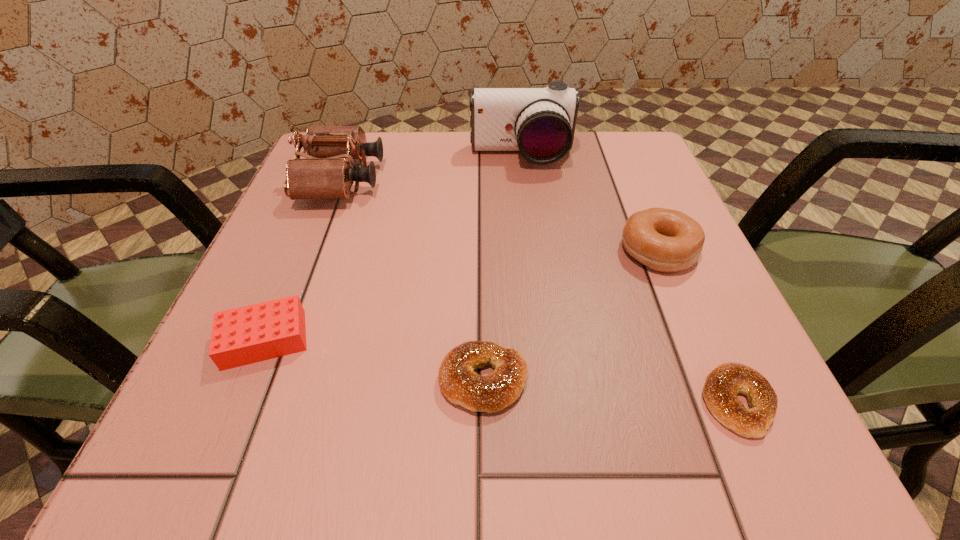
In the image, there is a desktop. Where is `vacant space at the far edge`? vacant space at the far edge is located at coordinates (468, 167).

Image resolution: width=960 pixels, height=540 pixels. I want to click on vacant position at the near edge of the desktop, so click(394, 429).

This screenshot has height=540, width=960. In the image, there is a desktop. Find the location of `vacant space at the left edge`. vacant space at the left edge is located at coordinates (316, 211).

In the image, there is a desktop. Identify the location of vacant space at the right edge. (600, 194).

Find the location of a particular element. This screenshot has width=960, height=540. free space at the far right corner of the desktop is located at coordinates (597, 161).

You are a GUI agent. You are given a task and a screenshot of the screen. Output one action in this format:
    pyautogui.click(x=<x>, y=<y>)
    Task: Click on the blank area at the near right corner
    
    Given the screenshot: What is the action you would take?
    pyautogui.click(x=708, y=441)

Image resolution: width=960 pixels, height=540 pixels. What are the coordinates of `unoccupied area between the third tallest object and the Lego` in the screenshot? It's located at (462, 295).

At what (x,y) coordinates should I click in order to perform the action: click on empty space between the third shortest object and the fourth nearest object. Please return your answer as a coordinate pair (x, y). This screenshot has width=960, height=540. Looking at the image, I should click on (462, 295).

Where is `vacant space that is in between the fourth tallest object and the fifth shortest object`? vacant space that is in between the fourth tallest object and the fifth shortest object is located at coordinates (303, 260).

Find the location of `vacant space that's between the shortest object and the binoculars`. vacant space that's between the shortest object and the binoculars is located at coordinates (540, 291).